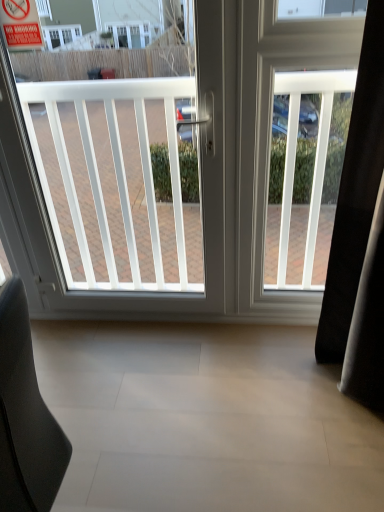
Where is `free spot to the right of white plastic window at center`? Image resolution: width=384 pixels, height=512 pixels. free spot to the right of white plastic window at center is located at coordinates (241, 354).